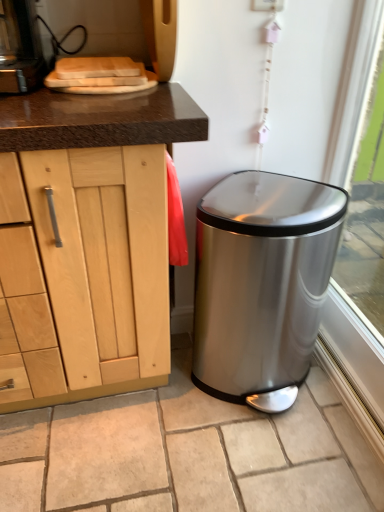
Question: Does polished stainless steel trash can at lower right have a lesser height compared to transparent glass window at lower right?

Choices:
 (A) no
 (B) yes

Answer: (B)

Question: Is polished stainless steel trash can at lower right at the right side of transparent glass window at lower right?

Choices:
 (A) yes
 (B) no

Answer: (B)

Question: Can you confirm if polished stainless steel trash can at lower right is positioned to the left of transparent glass window at lower right?

Choices:
 (A) no
 (B) yes

Answer: (B)

Question: Does polished stainless steel trash can at lower right have a greater width compared to transparent glass window at lower right?

Choices:
 (A) yes
 (B) no

Answer: (A)

Question: From the image's perspective, is polished stainless steel trash can at lower right above transparent glass window at lower right?

Choices:
 (A) yes
 (B) no

Answer: (B)

Question: Is polished stainless steel trash can at lower right to the left or to the right of satin silver trash can at lower right in the image?

Choices:
 (A) left
 (B) right

Answer: (B)

Question: From the image's perspective, is polished stainless steel trash can at lower right positioned above or below satin silver trash can at lower right?

Choices:
 (A) below
 (B) above

Answer: (B)

Question: Is polished stainless steel trash can at lower right taller or shorter than satin silver trash can at lower right?

Choices:
 (A) tall
 (B) short

Answer: (A)

Question: Relative to satin silver trash can at lower right, is polished stainless steel trash can at lower right in front or behind?

Choices:
 (A) front
 (B) behind

Answer: (B)

Question: Considering the positions of transparent glass window at lower right and satin silver trash can at lower right in the image, is transparent glass window at lower right wider or thinner than satin silver trash can at lower right?

Choices:
 (A) wide
 (B) thin

Answer: (B)

Question: From the image's perspective, is transparent glass window at lower right above or below satin silver trash can at lower right?

Choices:
 (A) above
 (B) below

Answer: (A)

Question: Is point (355, 41) closer or farther from the camera than point (266, 449)?

Choices:
 (A) closer
 (B) farther

Answer: (A)

Question: From a real-world perspective, relative to satin silver trash can at lower right, is transparent glass window at lower right vertically above or below?

Choices:
 (A) above
 (B) below

Answer: (A)

Question: Is satin silver trash can at lower right spatially inside polished stainless steel trash can at lower right, or outside of it?

Choices:
 (A) outside
 (B) inside

Answer: (A)

Question: In terms of width, does satin silver trash can at lower right look wider or thinner when compared to polished stainless steel trash can at lower right?

Choices:
 (A) thin
 (B) wide

Answer: (B)